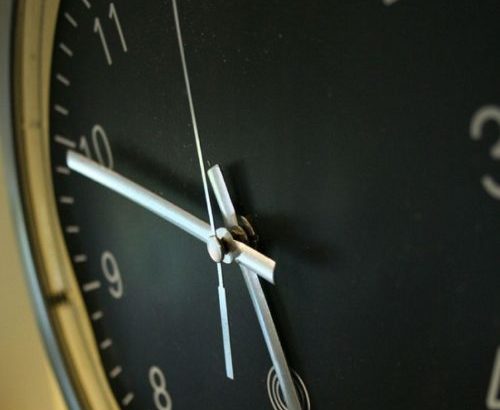
Where is `clock frame`? clock frame is located at coordinates pos(48,302).